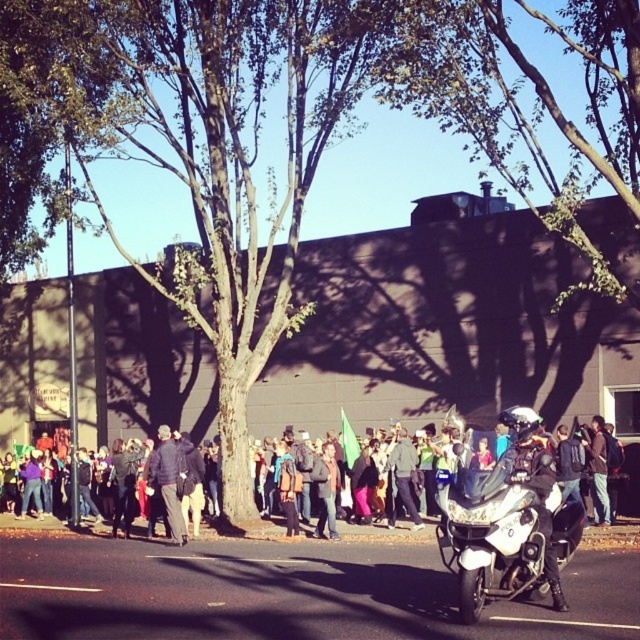
Can you confirm if denim jacket at center is positioned below dark gray jacket at center?

Yes, denim jacket at center is below dark gray jacket at center.

Is denim jacket at center thinner than dark gray jacket at center?

Incorrect, denim jacket at center's width is not less than dark gray jacket at center's.

In order to click on denim jacket at center in this screenshot , I will do `click(33, 528)`.

Which is in front, point (12, 522) or point (492, 616)?

Point (492, 616)

Is denim jacket at center to the right of black rubber line at lower center from the viewer's perspective?

No, denim jacket at center is not to the right of black rubber line at lower center.

What do you see at coordinates (33, 528) in the screenshot? I see `denim jacket at center` at bounding box center [33, 528].

Locate an element on the screen. denim jacket at center is located at coordinates (x=33, y=528).

Does point (156, 477) come in front of point (528, 620)?

No, it is not.

The height and width of the screenshot is (640, 640). What do you see at coordinates (168, 481) in the screenshot?
I see `dark gray jacket at center` at bounding box center [168, 481].

Locate an element on the screen. Image resolution: width=640 pixels, height=640 pixels. dark gray jacket at center is located at coordinates (168, 481).